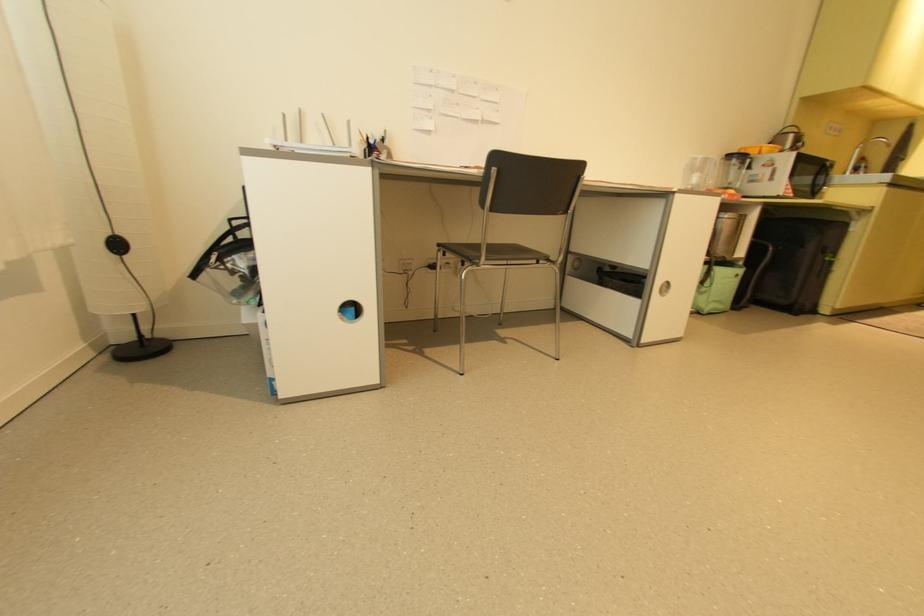
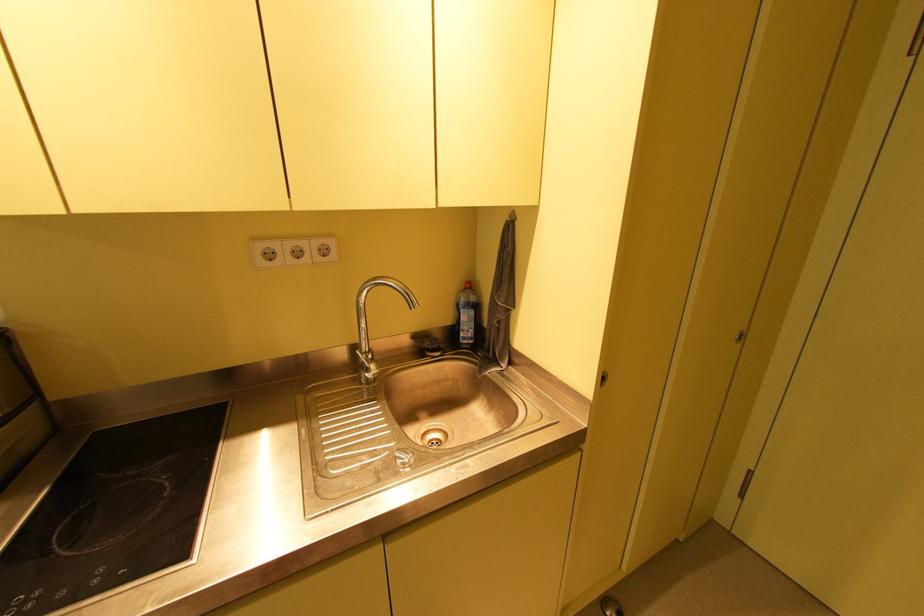
The images are taken continuously from a first-person perspective. In which direction are you moving?

The movement direction of the cameraman is right, forward.